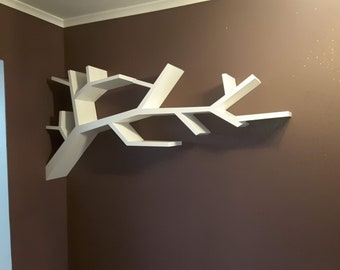
Where is `wall`? wall is located at coordinates tap(297, 170), tap(16, 192).